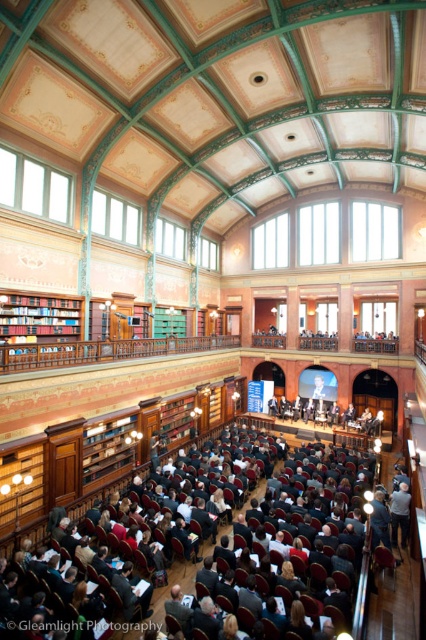
Question: Which point is closer to the camera?

Choices:
 (A) dark gray suit at center
 (B) wooden bookshelf at left

Answer: (A)

Question: Is dark gray suit at center to the right of wooden bookshelf at left from the viewer's perspective?

Choices:
 (A) no
 (B) yes

Answer: (B)

Question: Can you confirm if dark gray suit at center is thinner than wooden bookshelf at left?

Choices:
 (A) yes
 (B) no

Answer: (B)

Question: Which point is farther to the camera?

Choices:
 (A) dark gray suit at center
 (B) wooden bookshelf at left

Answer: (B)

Question: Is dark gray suit at center wider than wooden bookshelf at left?

Choices:
 (A) no
 (B) yes

Answer: (B)

Question: Which point is farther to the camera?

Choices:
 (A) wooden bookshelf at left
 (B) dark gray suit at center

Answer: (A)